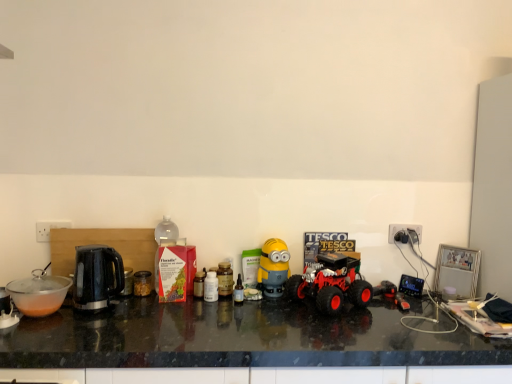
Where is `vacant area that is situated to the right of black plastic kettle at left`? vacant area that is situated to the right of black plastic kettle at left is located at coordinates (141, 314).